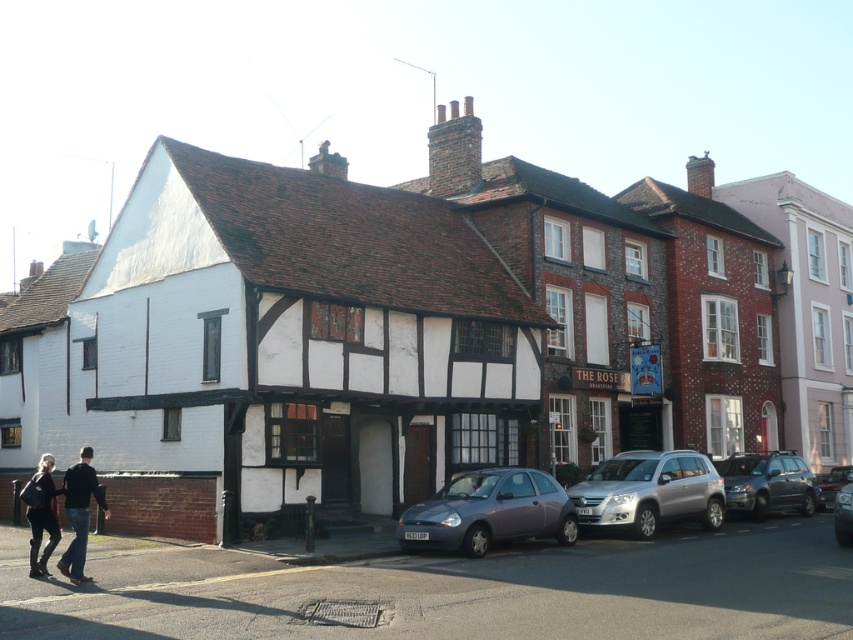
You are a delivery person needing to park your 1.8 meters tall delivery van between the metallic gray hatchback at center and the metallic silver car at center right. Can your van fit vertically between them?

The metallic gray hatchback at center is much taller than the metallic silver car at center right. Since your van is 1.8 meters tall, it might not fit vertically between them if the space between the two vehicles is narrower than 1.8 meters. However, the description only mentions their heights, not the distance between them. Without knowing the actual space between the two cars, it is impossible to determine if the van can fit.

You are a customer looking for a jacket to wear over your winter coat. You see the black leather jacket at lower left and the dark gray fabric jacket at lower left. Which jacket would you choose if you want something that covers more of your body?

The black leather jacket at lower left is much taller than the dark gray fabric jacket at lower left, so you should choose the black leather jacket at lower left to cover more of your body.

You are driving a car that is 1.8 meters wide and need to park in the space between the two buildings shown in the scene. The space is only wide enough for vehicles narrower than 1.8 meters. You see a metallic gray hatchback at center and a metallic silver car at center. Which vehicle can safely park in the space?

The metallic gray hatchback at center is thinner than the metallic silver car at center, so the metallic gray hatchback at center can safely park in the space since it is narrower than 1.8 meters.